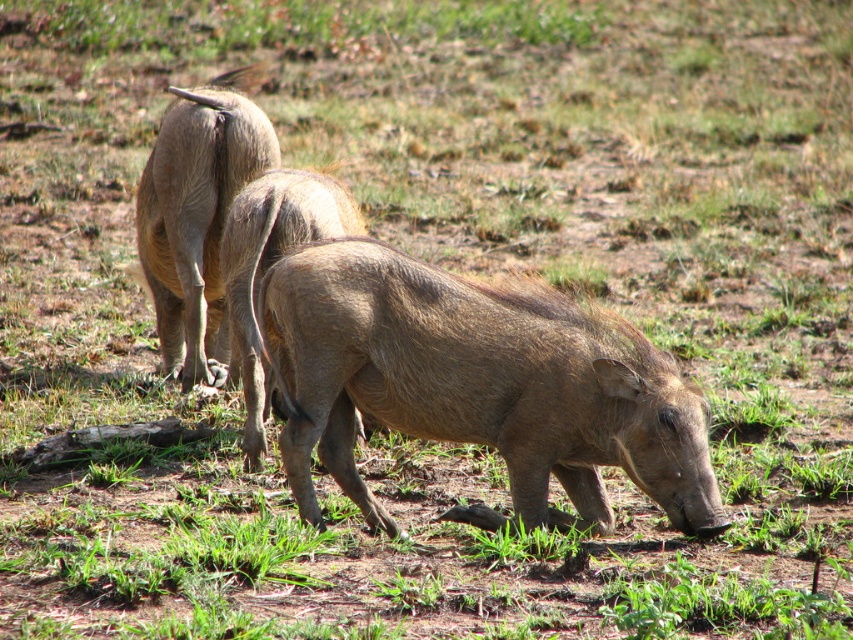
You are a wildlife photographer trying to capture a clear photo of the brown textured pig at center and the brown rough skin at center. Which one is closer to the camera?

The brown textured pig at center is closer to the camera because it is in front of the brown rough skin at center.

Where is the brown rough skin at upper left located in the image?

The brown rough skin at upper left is located at point (196,211) in the image.

You are a wildlife photographer trying to capture a photo of the brown textured pig at center and the brown rough skin at upper left. Which animal should you focus on first if you want to photograph the larger one?

The brown rough skin at upper left is larger than the brown textured pig at center, so you should focus on the brown rough skin at upper left first.